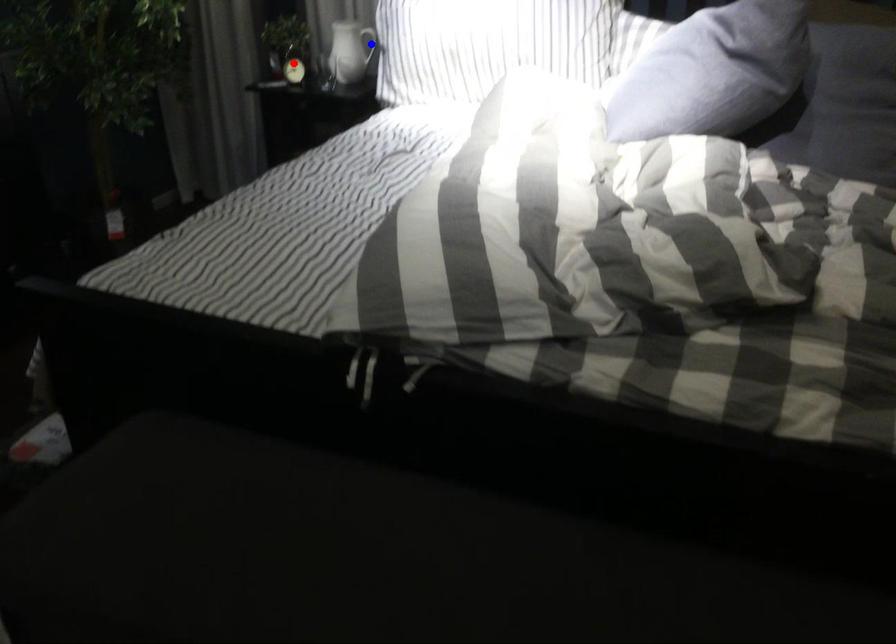
Question: Which of the two points in the image is closer to the camera?

Choices:
 (A) Blue point is closer.
 (B) Red point is closer.

Answer: (A)